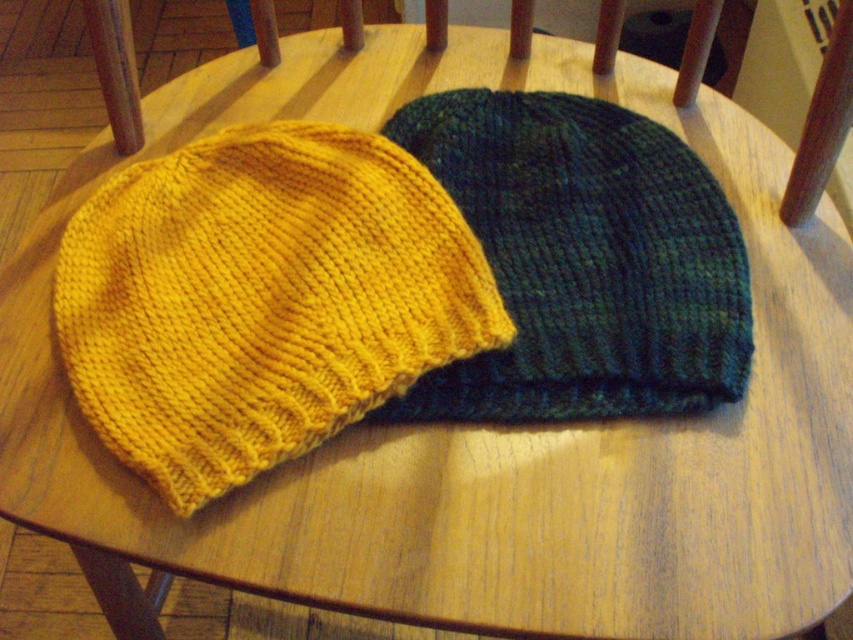
Which is behind, point (448, 307) or point (590, 147)?

Positioned behind is point (590, 147).

Does point (91, 388) come in front of point (721, 192)?

Yes, point (91, 388) is closer to viewer.

Is point (213, 253) behind point (610, 372)?

Yes.

Find the location of a particular element. yellow knitted hat at center is located at coordinates (260, 300).